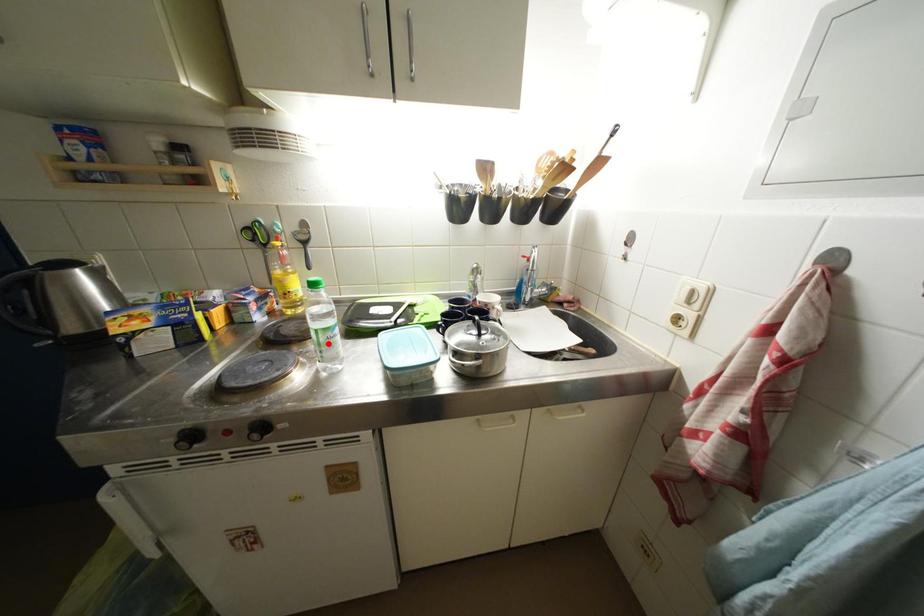
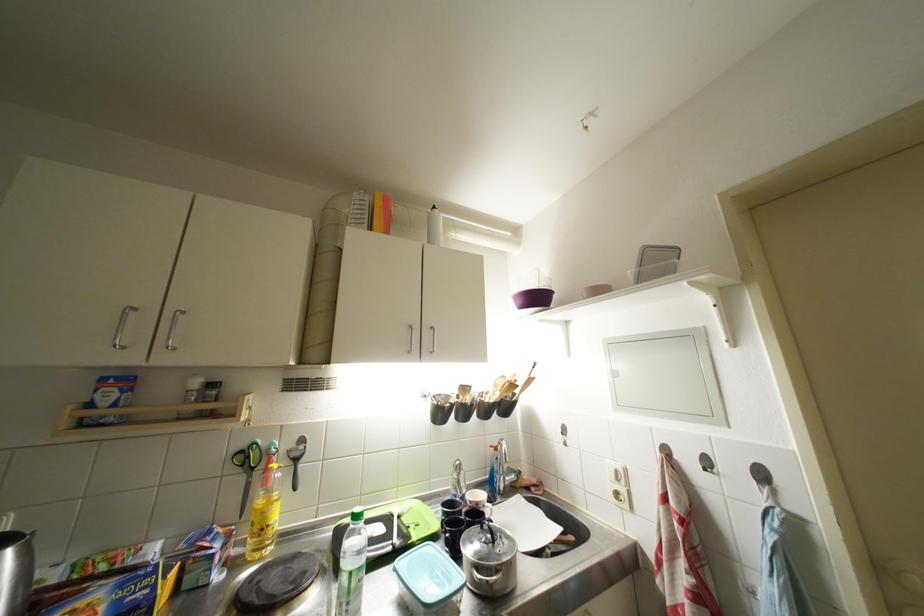
Where in the second image is the point corresponding to the highlighted location from the first image?

(359, 589)